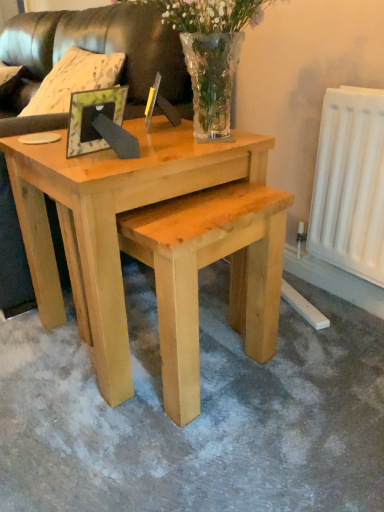
Measure the distance between point (196,25) and camera.

A distance of 38.27 inches exists between point (196,25) and camera.

This screenshot has width=384, height=512. Describe the element at coordinates (93, 118) in the screenshot. I see `green leafy frame at center` at that location.

The width and height of the screenshot is (384, 512). What do you see at coordinates (98, 52) in the screenshot?
I see `leather couch at upper left, the 1th couch from the front` at bounding box center [98, 52].

The image size is (384, 512). What do you see at coordinates (100, 51) in the screenshot?
I see `leather couch at upper left, the first couch viewed from the back` at bounding box center [100, 51].

What are the coordinates of `natural wood coffee table at center` in the screenshot? It's located at (113, 218).

Is green leafy frame at center closer to camera compared to leather couch at upper left, which is the 2th couch in front-to-back order?

Yes, it is in front of leather couch at upper left, which is the 2th couch in front-to-back order.

From the image's perspective, between green leafy frame at center and leather couch at upper left, the first couch viewed from the back, who is located below?

green leafy frame at center is shown below in the image.

From a real-world perspective, is green leafy frame at center physically below leather couch at upper left, the first couch viewed from the back?

Yes, from a real-world perspective, green leafy frame at center is beneath leather couch at upper left, the first couch viewed from the back.

Based on the photo, which object is positioned more to the left, green leafy frame at center or leather couch at upper left, the first couch viewed from the back?

leather couch at upper left, the first couch viewed from the back.

How much distance is there between leather couch at upper left, which is the 2th couch in front-to-back order, and natural wood coffee table at center?

leather couch at upper left, which is the 2th couch in front-to-back order, and natural wood coffee table at center are 23.93 inches apart.

Between leather couch at upper left, the first couch viewed from the back, and natural wood coffee table at center, which one is positioned behind?

leather couch at upper left, the first couch viewed from the back, is further from the camera.

From the image's perspective, between leather couch at upper left, which is the 2th couch in front-to-back order, and natural wood coffee table at center, which one is located above?

leather couch at upper left, which is the 2th couch in front-to-back order, appears higher in the image.

Could you tell me if leather couch at upper left, the first couch viewed from the back, is turned towards natural wood coffee table at center?

No, leather couch at upper left, the first couch viewed from the back, does not turn towards natural wood coffee table at center.

Is leather couch at upper left, the 1th couch from the front, bigger than clear glass vase at upper center?

Yes, leather couch at upper left, the 1th couch from the front, is bigger than clear glass vase at upper center.

Could you measure the distance between leather couch at upper left, the 1th couch from the front, and clear glass vase at upper center?

leather couch at upper left, the 1th couch from the front, and clear glass vase at upper center are 18.89 inches apart from each other.

Consider the image. What's the angular difference between leather couch at upper left, placed as the 2th couch when sorted from back to front, and clear glass vase at upper center's facing directions?

2.4 degrees.

From the image's perspective, which one is positioned higher, leather couch at upper left, placed as the 2th couch when sorted from back to front, or clear glass vase at upper center?

From the image's view, leather couch at upper left, placed as the 2th couch when sorted from back to front, is above.

Is clear glass vase at upper center aimed at leather couch at upper left, placed as the 2th couch when sorted from back to front?

A: No, clear glass vase at upper center is not facing towards leather couch at upper left, placed as the 2th couch when sorted from back to front.

Does clear glass vase at upper center have a lesser width compared to leather couch at upper left, placed as the 2th couch when sorted from back to front?

Indeed, clear glass vase at upper center has a lesser width compared to leather couch at upper left, placed as the 2th couch when sorted from back to front.

From a real-world perspective, is clear glass vase at upper center over leather couch at upper left, the 1th couch from the front?

Correct, in the physical world, clear glass vase at upper center is higher than leather couch at upper left, the 1th couch from the front.

Is clear glass vase at upper center not close to leather couch at upper left, the 1th couch from the front?

That's not correct — clear glass vase at upper center is a little close to leather couch at upper left, the 1th couch from the front.

Which is farther from the camera, (x=98, y=40) or (x=110, y=112)?

The point (x=98, y=40) is more distant.

From a real-world perspective, relative to green leafy frame at center, is leather couch at upper left, the first couch viewed from the back, vertically above or below?

leather couch at upper left, the first couch viewed from the back, is above green leafy frame at center.

I want to click on picture frame below the leather couch at upper left, the first couch viewed from the back (from a real-world perspective), so click(x=93, y=118).

Does leather couch at upper left, the first couch viewed from the back, appear on the left side of green leafy frame at center?

Correct, you'll find leather couch at upper left, the first couch viewed from the back, to the left of green leafy frame at center.

Can you tell me how much leather couch at upper left, placed as the 2th couch when sorted from back to front, and leather couch at upper left, which is the 2th couch in front-to-back order, differ in facing direction?

1.56 degrees.

Can you confirm if leather couch at upper left, placed as the 2th couch when sorted from back to front, is thinner than leather couch at upper left, the first couch viewed from the back?

In fact, leather couch at upper left, placed as the 2th couch when sorted from back to front, might be wider than leather couch at upper left, the first couch viewed from the back.

Measure the distance between leather couch at upper left, the 1th couch from the front, and leather couch at upper left, the first couch viewed from the back.

leather couch at upper left, the 1th couch from the front, is 0.58 inches away from leather couch at upper left, the first couch viewed from the back.

Is leather couch at upper left, the 1th couch from the front, not near leather couch at upper left, the first couch viewed from the back?

leather couch at upper left, the 1th couch from the front, is actually quite close to leather couch at upper left, the first couch viewed from the back.

From a real-world perspective, between clear glass vase at upper center and leather couch at upper left, the first couch viewed from the back, who is vertically higher?

From a 3D spatial view, clear glass vase at upper center is above.

Is point (194, 14) positioned behind point (70, 35)?

No, (194, 14) is closer to viewer.

From the image's perspective, does clear glass vase at upper center appear lower than leather couch at upper left, which is the 2th couch in front-to-back order?

Yes.

Can you confirm if clear glass vase at upper center is thinner than leather couch at upper left, the first couch viewed from the back?

Correct, the width of clear glass vase at upper center is less than that of leather couch at upper left, the first couch viewed from the back.

This screenshot has width=384, height=512. Identify the location of picture frame in front of the leather couch at upper left, which is the 2th couch in front-to-back order. (93, 118).

From the natural wood coffee table at center, count 2nd couchs backward and point to it. Please provide its 2D coordinates.

[(100, 51)]

Based on their spatial positions, is leather couch at upper left, the first couch viewed from the back, or leather couch at upper left, placed as the 2th couch when sorted from back to front, further from clear glass vase at upper center?

The object further to clear glass vase at upper center is leather couch at upper left, the first couch viewed from the back.

When comparing their distances from green leafy frame at center, does leather couch at upper left, placed as the 2th couch when sorted from back to front, or clear glass vase at upper center seem closer?

clear glass vase at upper center lies closer to green leafy frame at center than the other object.

Looking at the image, which one is located further to green leafy frame at center, leather couch at upper left, the first couch viewed from the back, or clear glass vase at upper center?

Among the two, leather couch at upper left, the first couch viewed from the back, is located further to green leafy frame at center.

From the image, which object appears to be farther from clear glass vase at upper center, leather couch at upper left, the first couch viewed from the back, or green leafy frame at center?

The object further to clear glass vase at upper center is leather couch at upper left, the first couch viewed from the back.

Considering their positions, is green leafy frame at center positioned further to clear glass vase at upper center than leather couch at upper left, the 1th couch from the front?

Among the two, leather couch at upper left, the 1th couch from the front, is located further to clear glass vase at upper center.

Based on their spatial positions, is leather couch at upper left, which is the 2th couch in front-to-back order, or green leafy frame at center closer to leather couch at upper left, placed as the 2th couch when sorted from back to front?

leather couch at upper left, which is the 2th couch in front-to-back order, is closer to leather couch at upper left, placed as the 2th couch when sorted from back to front.

In the scene shown: Looking at the image, which one is located further to natural wood coffee table at center, leather couch at upper left, placed as the 2th couch when sorted from back to front, or leather couch at upper left, which is the 2th couch in front-to-back order?

leather couch at upper left, which is the 2th couch in front-to-back order, lies further to natural wood coffee table at center than the other object.

Estimate the real-world distances between objects in this image. Which object is further from green leafy frame at center, clear glass vase at upper center or natural wood coffee table at center?

Based on the image, clear glass vase at upper center appears to be further to green leafy frame at center.

The height and width of the screenshot is (512, 384). I want to click on floral arrangement between leather couch at upper left, which is the 2th couch in front-to-back order, and natural wood coffee table at center vertically, so click(x=210, y=53).

Identify the location of couch located between leather couch at upper left, placed as the 2th couch when sorted from back to front, and clear glass vase at upper center in the left-right direction. (100, 51).

The width and height of the screenshot is (384, 512). In order to click on picture frame between leather couch at upper left, the first couch viewed from the back, and clear glass vase at upper center in this screenshot , I will do `click(93, 118)`.

Locate an element on the screen. The width and height of the screenshot is (384, 512). picture frame located between leather couch at upper left, the 1th couch from the front, and natural wood coffee table at center in the left-right direction is located at coordinates (93, 118).